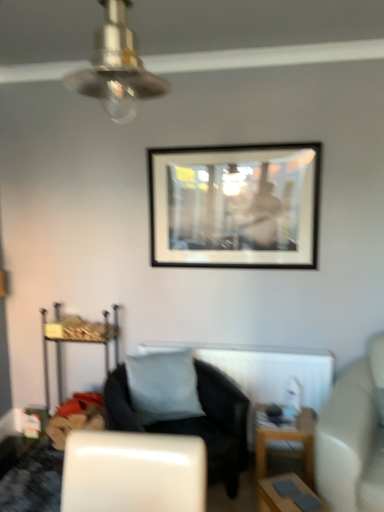
Question: Should I look upward or downward to see black matte picture frame at upper center?

Choices:
 (A) down
 (B) up

Answer: (B)

Question: Is white matte radiator at center not near white leather couch at right?

Choices:
 (A) no
 (B) yes

Answer: (A)

Question: Can you confirm if white matte radiator at center is bigger than white leather couch at right?

Choices:
 (A) no
 (B) yes

Answer: (A)

Question: Is white matte radiator at center oriented away from white leather couch at right?

Choices:
 (A) no
 (B) yes

Answer: (A)

Question: Is white matte radiator at center to the left of white leather couch at right from the viewer's perspective?

Choices:
 (A) no
 (B) yes

Answer: (B)

Question: Does white matte radiator at center have a smaller size compared to white leather couch at right?

Choices:
 (A) no
 (B) yes

Answer: (B)

Question: Is white matte radiator at center positioned in front of white leather couch at right?

Choices:
 (A) yes
 (B) no

Answer: (B)

Question: From a real-world perspective, is white leather couch at right physically above wooden table at lower right, which is counted as the first table, starting from the back?

Choices:
 (A) no
 (B) yes

Answer: (B)

Question: Is white leather couch at right aimed at wooden table at lower right, the second table from the front?

Choices:
 (A) no
 (B) yes

Answer: (A)

Question: Is white leather couch at right at the left side of wooden table at lower right, which is counted as the first table, starting from the back?

Choices:
 (A) no
 (B) yes

Answer: (A)

Question: Can you confirm if white leather couch at right is thinner than wooden table at lower right, which is counted as the first table, starting from the back?

Choices:
 (A) yes
 (B) no

Answer: (B)

Question: Are white leather couch at right and wooden table at lower right, the second table from the front, located far from each other?

Choices:
 (A) yes
 (B) no

Answer: (B)

Question: Is white leather couch at right further to the viewer compared to wooden table at lower right, the second table from the front?

Choices:
 (A) yes
 (B) no

Answer: (B)

Question: Are metallic silver ceiling fan at upper center and black fabric chair at center far apart?

Choices:
 (A) no
 (B) yes

Answer: (B)